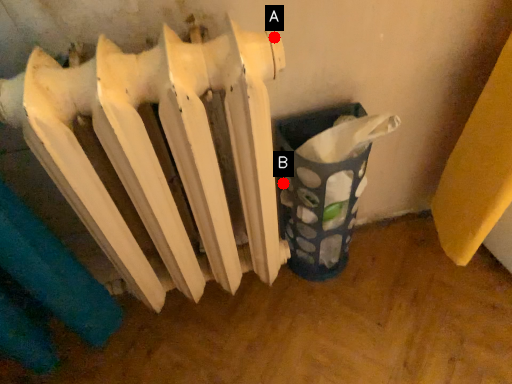
Question: Two points are circled on the image, labeled by A and B beside each circle. Among these points, which one is farthest from the camera?

Choices:
 (A) A is further
 (B) B is further

Answer: (B)